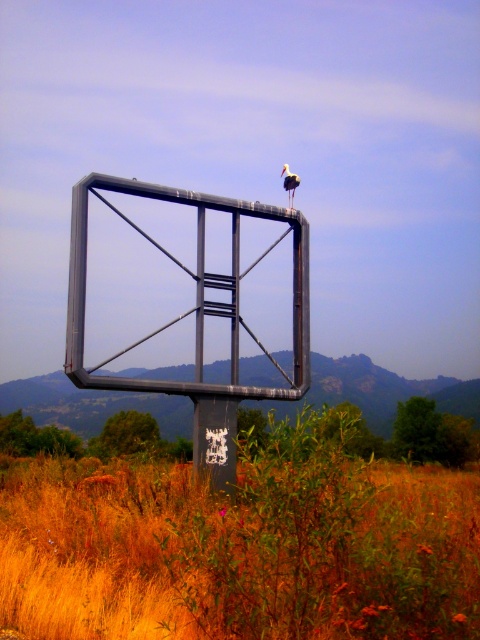
In the scene shown: Who is positioned more to the left, brown dry grass at lower center or white matte bird at upper center?

From the viewer's perspective, brown dry grass at lower center appears more on the left side.

Find the location of a particular element. The width and height of the screenshot is (480, 640). brown dry grass at lower center is located at coordinates (239, 552).

Which is in front, point (156, 525) or point (285, 168)?

Point (156, 525)

Image resolution: width=480 pixels, height=640 pixels. Find the location of `brown dry grass at lower center`. brown dry grass at lower center is located at coordinates (239, 552).